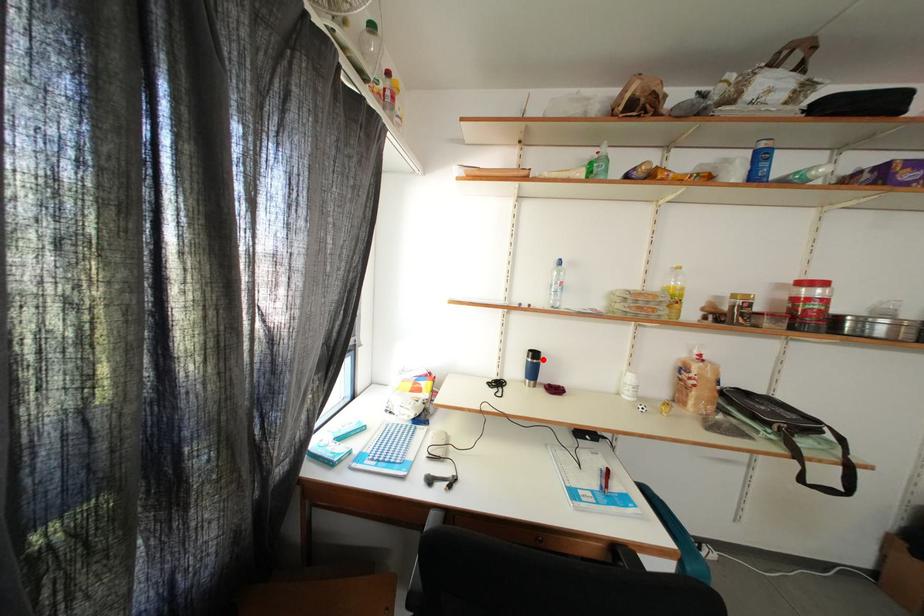
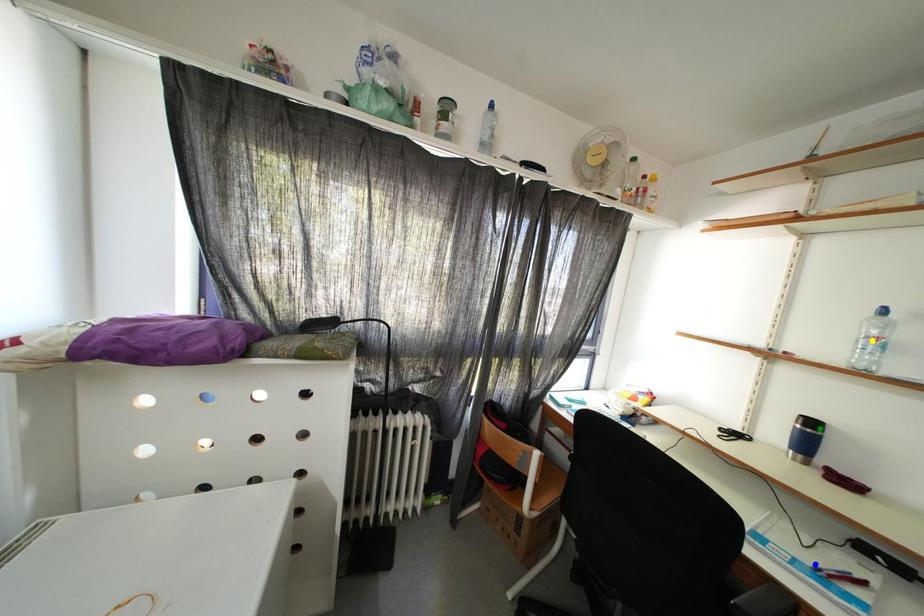
Question: I am providing you with two images of the same scene from different viewpoints. A red point is marked on the first image. You are given multiple points on the second image. Which spot in image 2 lines up with the point in image 1?

Choices:
 (A) blue point
 (B) yellow point
 (C) green point

Answer: (C)